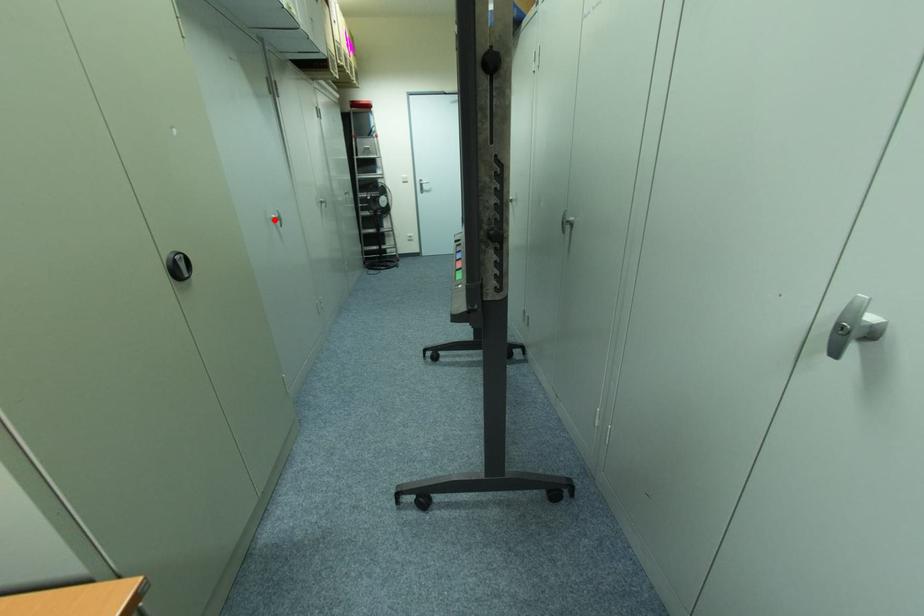
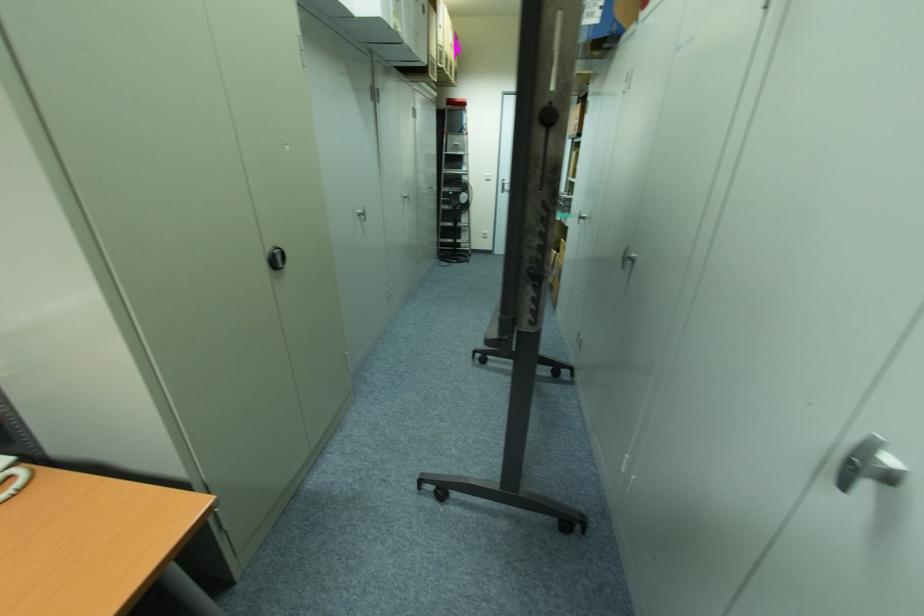
The point at the highlighted location is marked in the first image. Where is the corresponding point in the second image?

(361, 215)